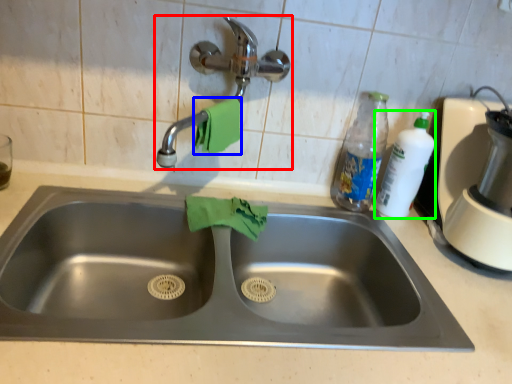
Question: Which object is positioned farthest from tap (highlighted by a red box)? Select from hand towel (highlighted by a blue box) and cleaning product (highlighted by a green box).

Choices:
 (A) hand towel
 (B) cleaning product

Answer: (B)